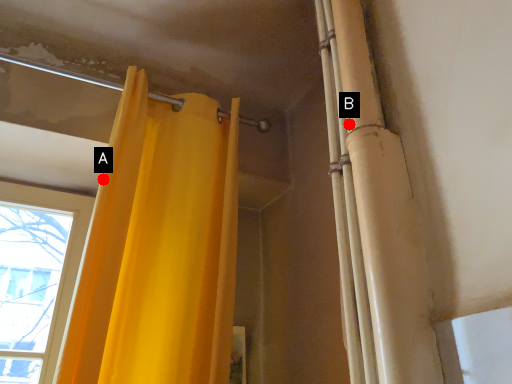
Question: Two points are circled on the image, labeled by A and B beside each circle. Which point is closer to the camera taking this photo?

Choices:
 (A) A is closer
 (B) B is closer

Answer: (B)